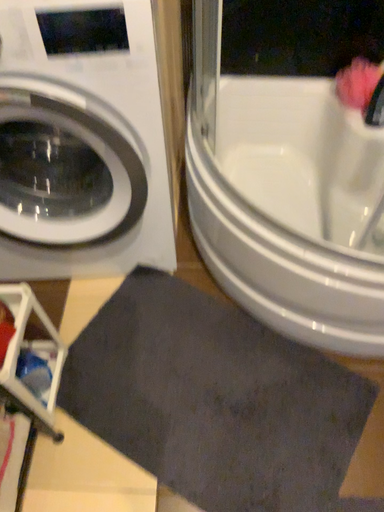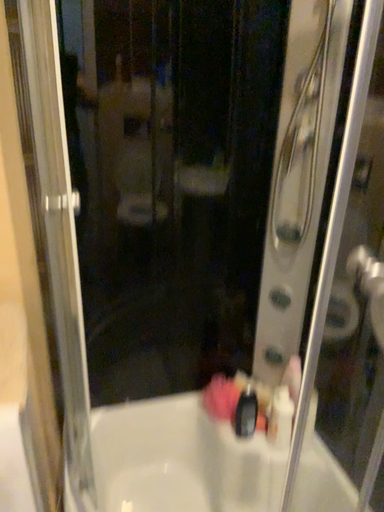
Question: Which way did the camera rotate in the video?

Choices:
 (A) rotated upward
 (B) rotated downward

Answer: (A)